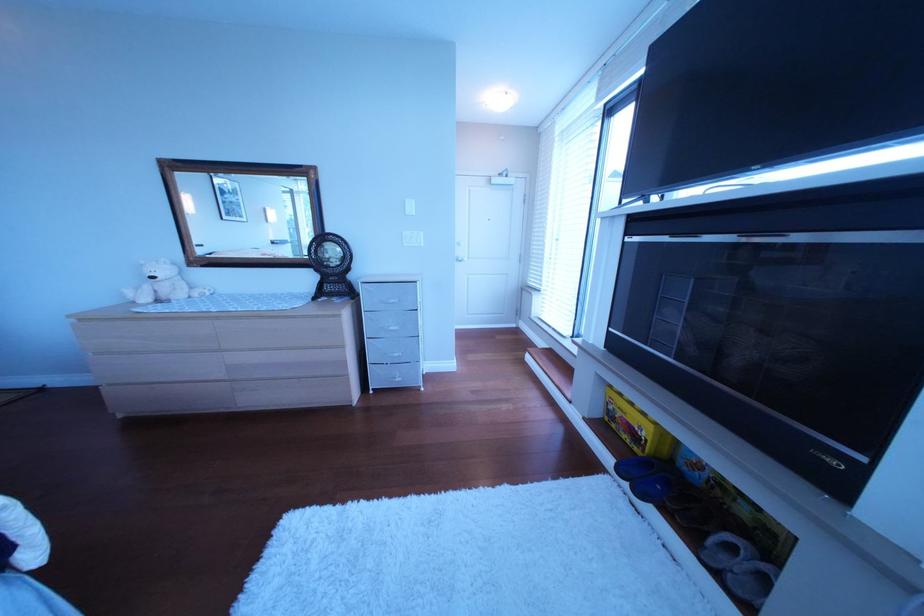
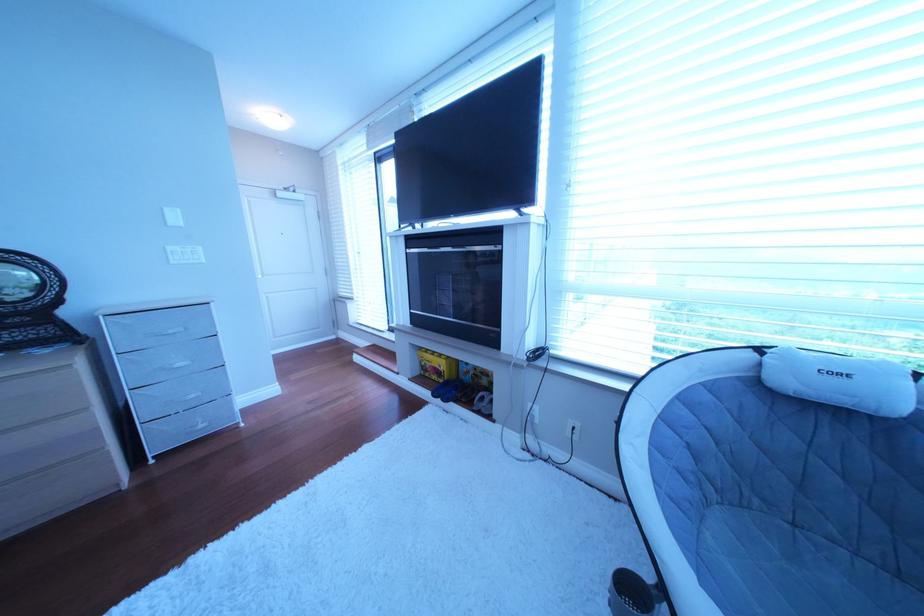
Where in the second image is the point corresponding to the point at 635,416 from the first image?

(444, 367)